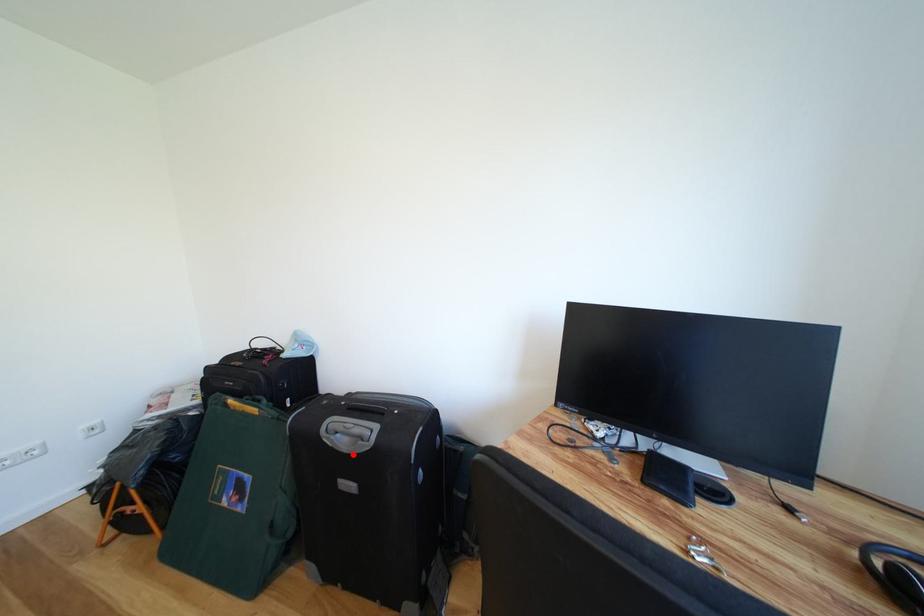
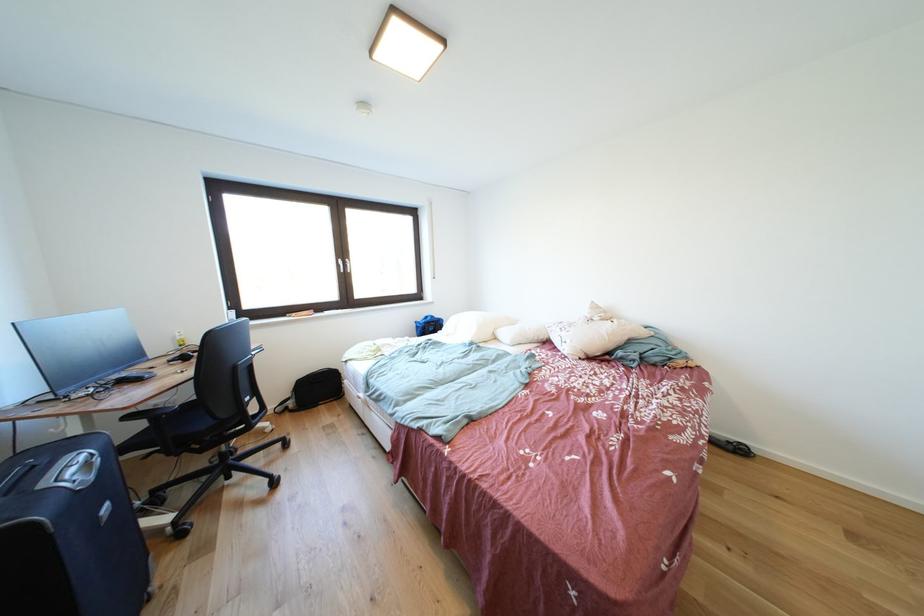
Where in the second image is the point corresponding to the highlighted location from the first image?

(101, 483)